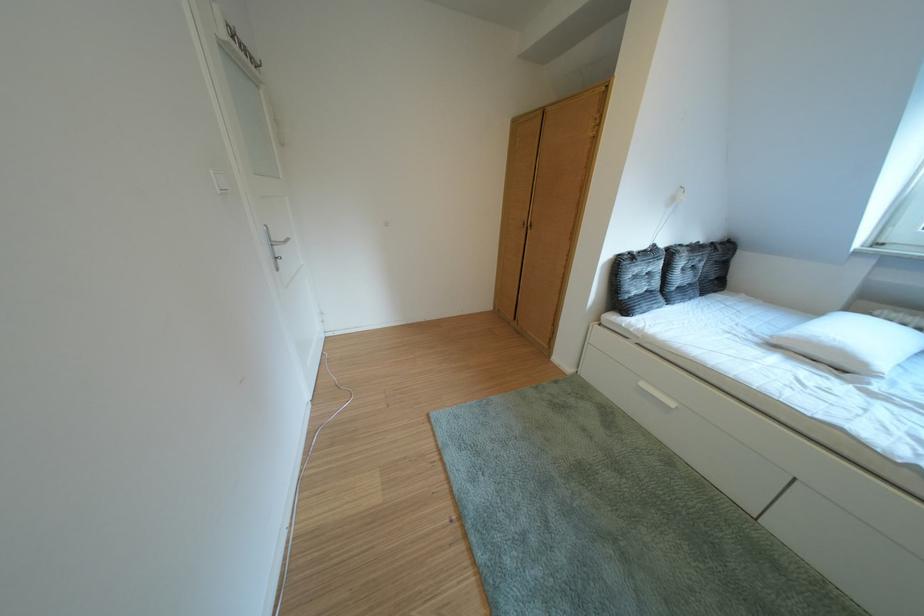
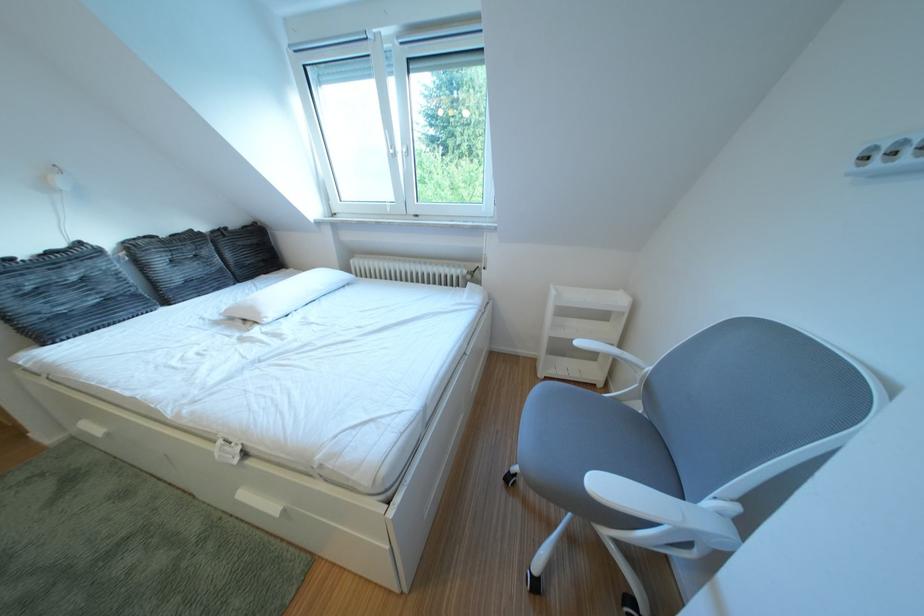
Find the pixel in the second image that matches (734,243) in the first image.

(247, 228)